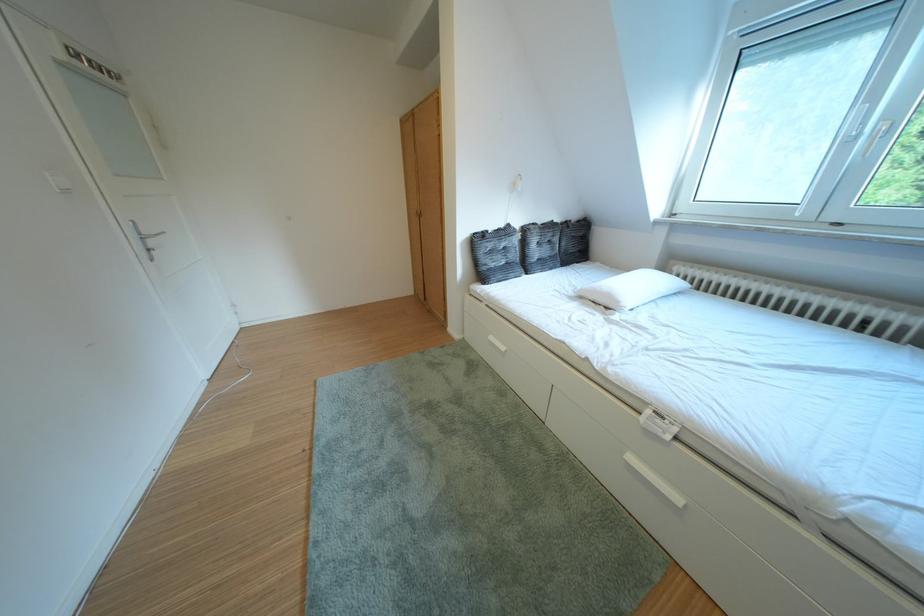
Find where to push the white light switch. Please return your answer as a coordinate pair (x, y).

(59, 182)